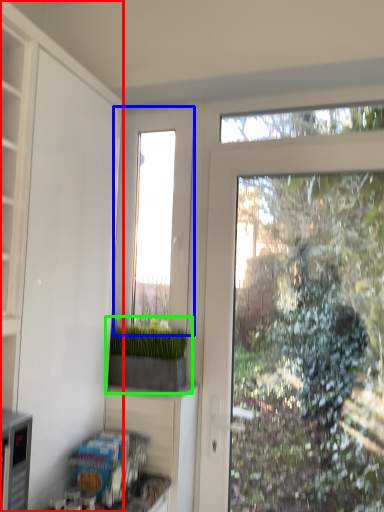
Question: Estimate the real-world distances between objects in this image. Which object is closer to cabinetry (highlighted by a red box), window (highlighted by a blue box) or houseplant (highlighted by a green box)?

Choices:
 (A) window
 (B) houseplant

Answer: (B)